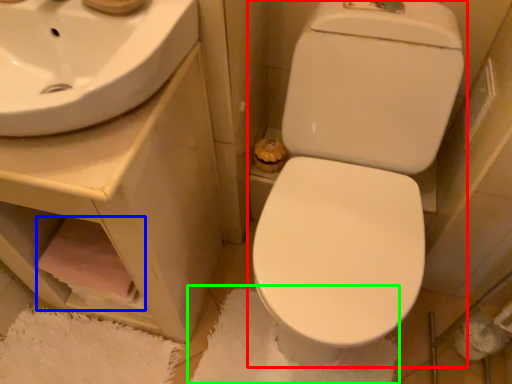
Question: Which object is the farthest from toilet (highlighted by a red box)? Choose among these: toilet paper (highlighted by a blue box) or bath mat (highlighted by a green box).

Choices:
 (A) toilet paper
 (B) bath mat

Answer: (A)